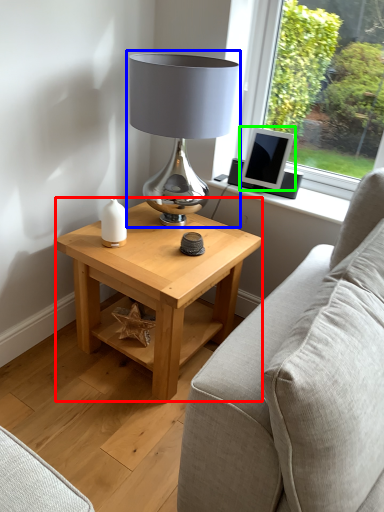
Question: Considering the real-world distances, which object is farthest from table (highlighted by a red box)? lamp (highlighted by a blue box) or computer monitor (highlighted by a green box)?

Choices:
 (A) lamp
 (B) computer monitor

Answer: (B)